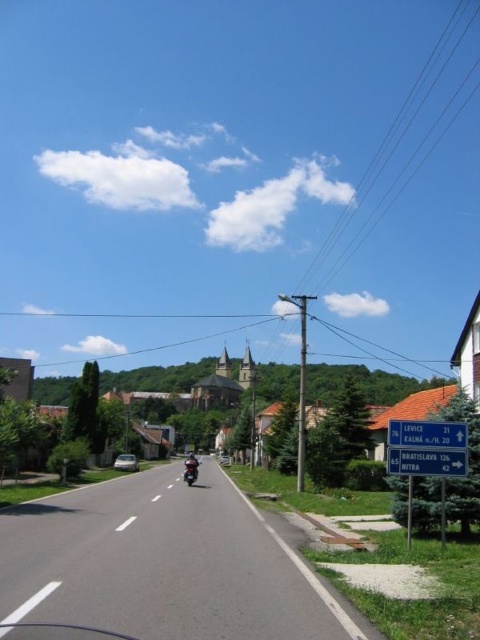
Between white plastic sign at center right and shiny black motorcycle at center, which one is positioned lower?

Positioned lower is shiny black motorcycle at center.

Does white plastic sign at center right have a smaller size compared to shiny black motorcycle at center?

Correct, white plastic sign at center right occupies less space than shiny black motorcycle at center.

The image size is (480, 640). What do you see at coordinates (425, 461) in the screenshot?
I see `white plastic sign at center right` at bounding box center [425, 461].

Find the location of `white plastic sign at center right`. white plastic sign at center right is located at coordinates (425, 461).

Who is positioned more to the right, white plastic sign at center right or blue plastic sign at upper right?

Positioned to the right is blue plastic sign at upper right.

Is white plastic sign at center right bigger than blue plastic sign at upper right?

Indeed, white plastic sign at center right has a larger size compared to blue plastic sign at upper right.

In order to click on white plastic sign at center right in this screenshot , I will do `click(425, 461)`.

The width and height of the screenshot is (480, 640). What are the coordinates of `white plastic sign at center right` in the screenshot? It's located at (425, 461).

Is point (389, 436) in front of point (194, 474)?

That is True.

Does blue plastic sign at upper right appear over shiny black motorcycle at center?

Yes.

Which is in front, point (460, 444) or point (190, 456)?

Point (460, 444) is more forward.

Locate an element on the screen. Image resolution: width=480 pixels, height=640 pixels. blue plastic sign at upper right is located at coordinates (427, 435).